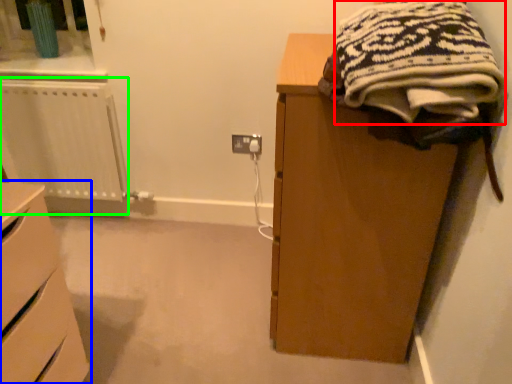
Question: Based on their relative distances, which object is nearer to clothing (highlighted by a red box)? Choose from chest of drawers (highlighted by a blue box) and radiator (highlighted by a green box).

Choices:
 (A) chest of drawers
 (B) radiator

Answer: (A)